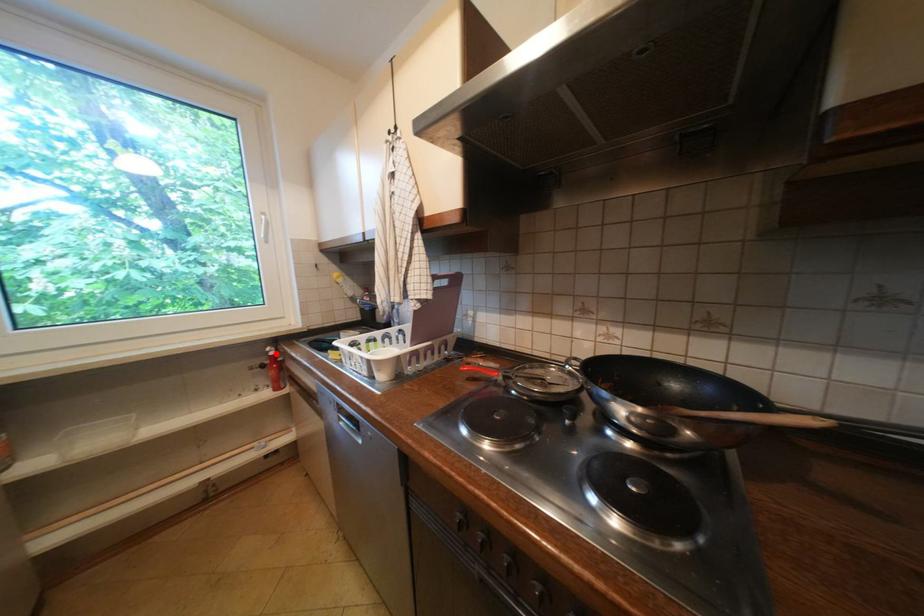
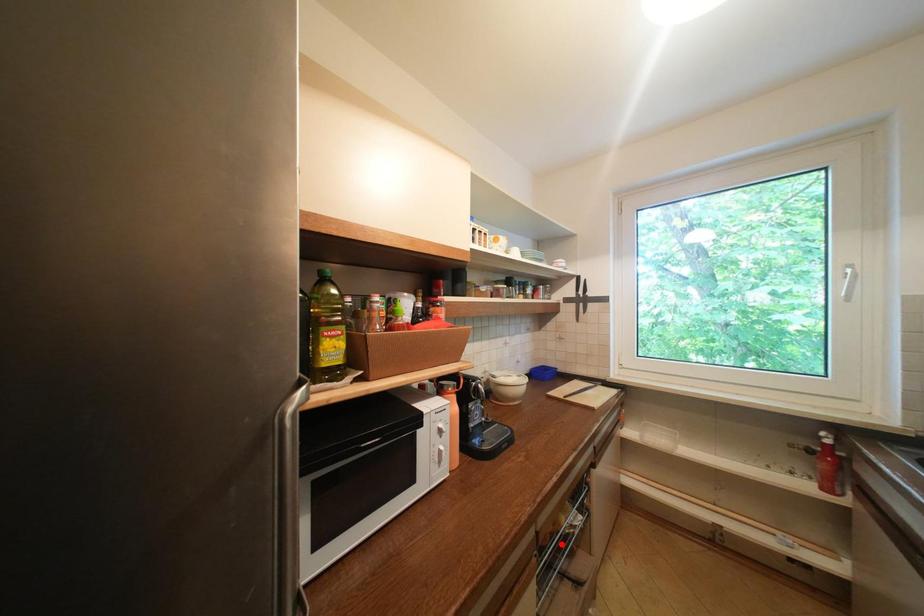
Consider the image. I am providing you with two images of the same scene from different viewpoints. A red point is marked on the first image and another point is marked on the second image. Is the marked point in image1 the same physical position as the marked point in image2?

A: No